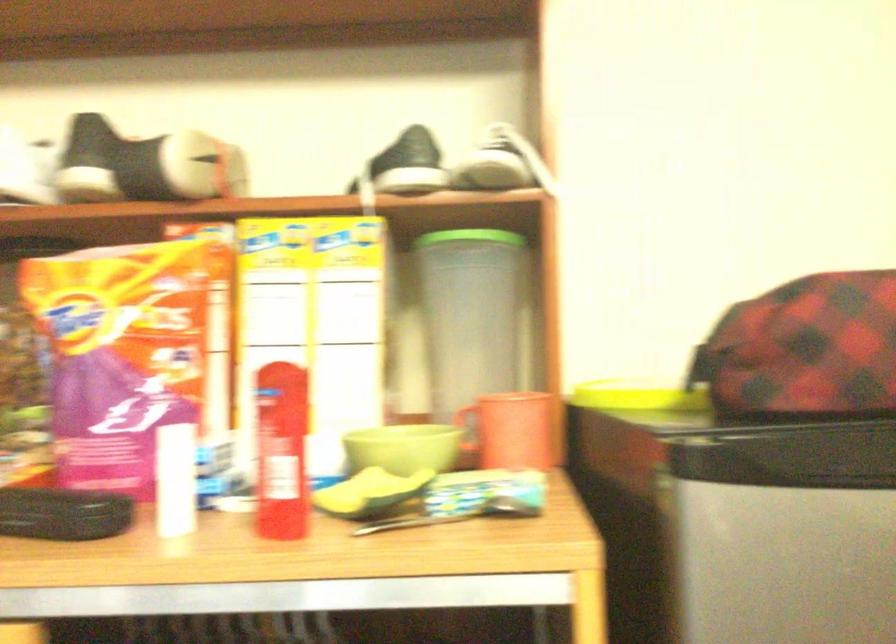
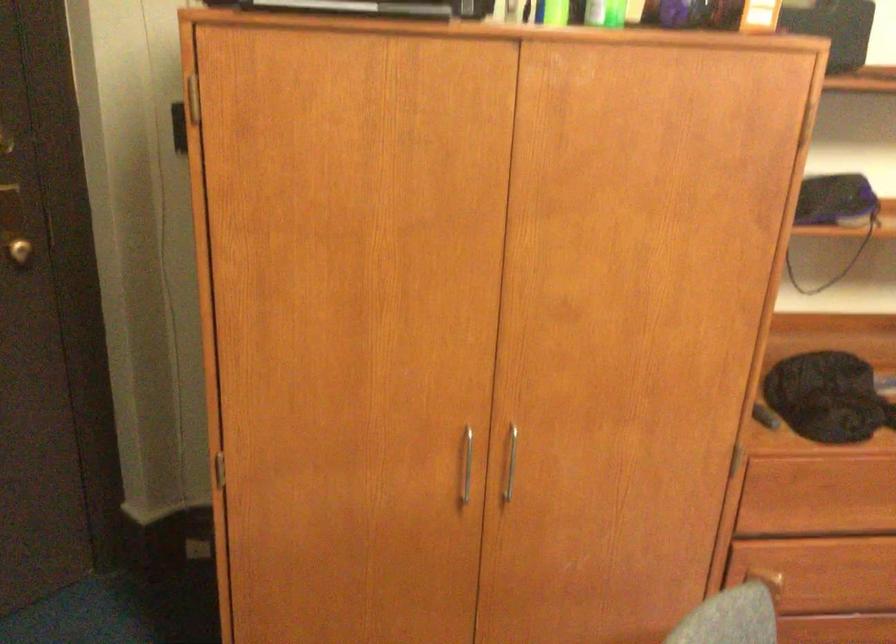
From the picture: First-person continuous shooting, in which direction is the camera rotating?

The camera rotated toward right-down.